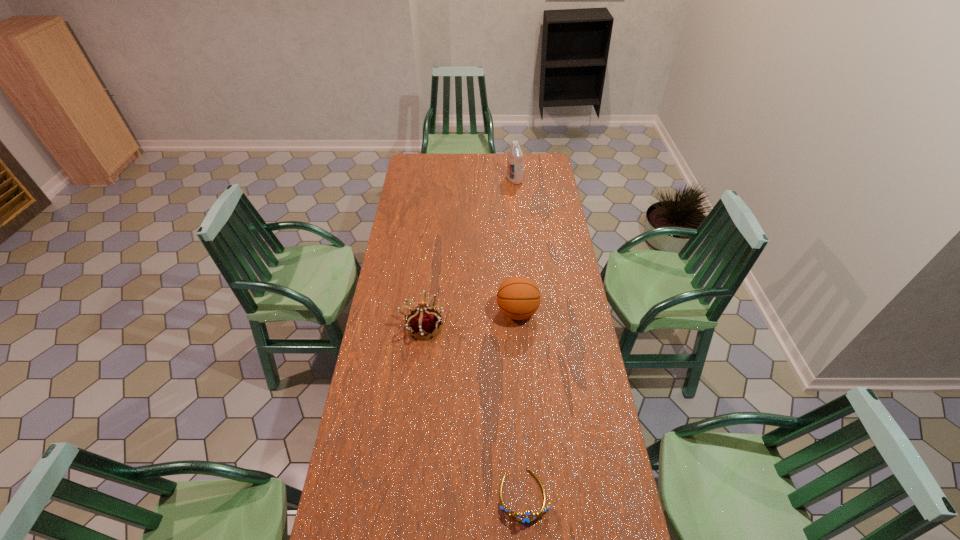
Identify the location of empty location between the leftmost object and the basketball. (470, 319).

Locate an element on the screen. free space between the shorter tiara and the basketball is located at coordinates (520, 403).

The image size is (960, 540). I want to click on empty space between the left tiara and the detergent, so click(x=468, y=253).

Locate an element on the screen. The height and width of the screenshot is (540, 960). free point between the tallest object and the shorter tiara is located at coordinates (519, 338).

Find the location of a particular element. Image resolution: width=960 pixels, height=540 pixels. free space between the basketball and the nearer tiara is located at coordinates (520, 403).

Image resolution: width=960 pixels, height=540 pixels. Identify the location of vacant space in between the shortest object and the basketball. (520, 403).

Identify which object is located as the second nearest to the left tiara. Please provide its 2D coordinates. Your answer should be formatted as a tuple, i.e. [(x, y)], where the tuple contains the x and y coordinates of a point satisfying the conditions above.

[(531, 517)]

Identify which object is the second nearest to the basketball. Please provide its 2D coordinates. Your answer should be formatted as a tuple, i.e. [(x, y)], where the tuple contains the x and y coordinates of a point satisfying the conditions above.

[(531, 517)]

Where is `free space that satisfies the following two spatial constraints: 1. on the back side of the tallest object; 2. on the right side of the basketball`? This screenshot has height=540, width=960. free space that satisfies the following two spatial constraints: 1. on the back side of the tallest object; 2. on the right side of the basketball is located at coordinates pyautogui.click(x=507, y=180).